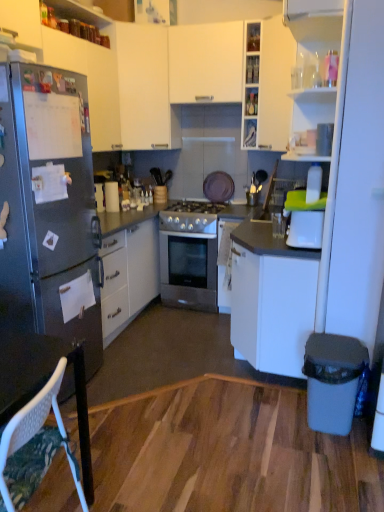
Question: Can you confirm if white matte cabinet at upper center, marked as the third cabinetry in a right-to-left arrangement, is shorter than white plastic trash can at lower right?

Choices:
 (A) yes
 (B) no

Answer: (B)

Question: Is white matte cabinet at upper center, placed as the second cabinetry when sorted from left to right, to the left of white plastic trash can at lower right from the viewer's perspective?

Choices:
 (A) no
 (B) yes

Answer: (B)

Question: Can we say white matte cabinet at upper center, marked as the third cabinetry in a right-to-left arrangement, lies outside white plastic trash can at lower right?

Choices:
 (A) yes
 (B) no

Answer: (A)

Question: Is white matte cabinet at upper center, marked as the third cabinetry in a right-to-left arrangement, looking in the opposite direction of white plastic trash can at lower right?

Choices:
 (A) no
 (B) yes

Answer: (A)

Question: Can you confirm if white matte cabinet at upper center, marked as the third cabinetry in a right-to-left arrangement, is wider than white plastic trash can at lower right?

Choices:
 (A) yes
 (B) no

Answer: (A)

Question: From the image's perspective, is white matte cabinet at upper center, marked as the third cabinetry in a right-to-left arrangement, under white plastic trash can at lower right?

Choices:
 (A) yes
 (B) no

Answer: (B)

Question: Is white matte cabinet at upper center, which appears as the second cabinetry when viewed from the right, not inside white matte cabinet at upper center, marked as the third cabinetry in a right-to-left arrangement?

Choices:
 (A) yes
 (B) no

Answer: (A)

Question: Is white matte cabinet at upper center, arranged as the 3th cabinetry when viewed from the left, behind white matte cabinet at upper center, marked as the third cabinetry in a right-to-left arrangement?

Choices:
 (A) no
 (B) yes

Answer: (A)

Question: Is white matte cabinet at upper center, arranged as the 3th cabinetry when viewed from the left, oriented away from white matte cabinet at upper center, placed as the second cabinetry when sorted from left to right?

Choices:
 (A) yes
 (B) no

Answer: (B)

Question: Is white matte cabinet at upper center, which appears as the second cabinetry when viewed from the right, at the left side of white matte cabinet at upper center, placed as the second cabinetry when sorted from left to right?

Choices:
 (A) yes
 (B) no

Answer: (B)

Question: From a real-world perspective, is white matte cabinet at upper center, arranged as the 3th cabinetry when viewed from the left, located higher than white matte cabinet at upper center, placed as the second cabinetry when sorted from left to right?

Choices:
 (A) yes
 (B) no

Answer: (A)

Question: From the image's perspective, is white matte cabinet at upper center, arranged as the 3th cabinetry when viewed from the left, under white matte cabinet at upper center, marked as the third cabinetry in a right-to-left arrangement?

Choices:
 (A) yes
 (B) no

Answer: (B)

Question: Does white plastic trash can at lower right have a greater height compared to white matte cabinet at upper center, which is counted as the 4th cabinetry, starting from the left?

Choices:
 (A) yes
 (B) no

Answer: (B)